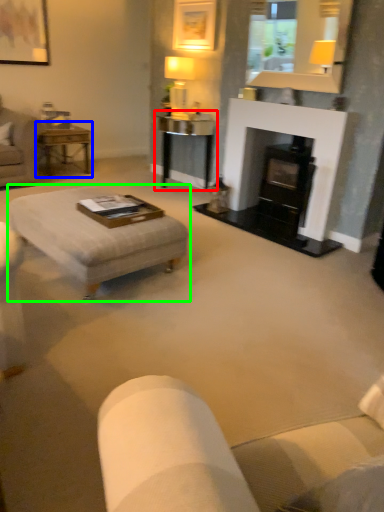
Question: Which object is the closest to the table (highlighted by a red box)? Choose among these: table (highlighted by a blue box) or coffee table (highlighted by a green box).

Choices:
 (A) table
 (B) coffee table

Answer: (A)